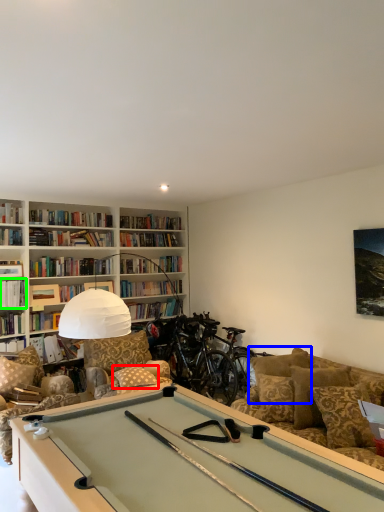
Question: Which object is positioned farthest from pillow (highlighted by a red box)? Select from pillow (highlighted by a blue box) and book (highlighted by a green box).

Choices:
 (A) pillow
 (B) book

Answer: (B)